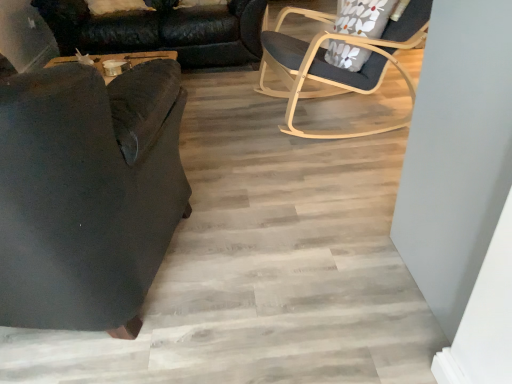
Question: Is floral fabric pillow at upper right oriented away from light wood/transparentobject at upper right, which is the 2th chair in front-to-back order?

Choices:
 (A) yes
 (B) no

Answer: (A)

Question: Is floral fabric pillow at upper right thinner than light wood/transparentobject at upper right, the second chair viewed from the left?

Choices:
 (A) yes
 (B) no

Answer: (A)

Question: Does floral fabric pillow at upper right contain light wood/transparentobject at upper right, arranged as the first chair when viewed from the right?

Choices:
 (A) no
 (B) yes

Answer: (A)

Question: Does floral fabric pillow at upper right touch light wood/transparentobject at upper right, the second chair viewed from the left?

Choices:
 (A) yes
 (B) no

Answer: (B)

Question: Is floral fabric pillow at upper right wider than light wood/transparentobject at upper right, arranged as the 1th chair when viewed from the back?

Choices:
 (A) yes
 (B) no

Answer: (B)

Question: Is floral fabric pillow at upper right closer to the viewer compared to light wood/transparentobject at upper right, arranged as the first chair when viewed from the right?

Choices:
 (A) yes
 (B) no

Answer: (B)

Question: Is light wood/transparentobject at upper right, arranged as the first chair when viewed from the right, located within dark fabric chair at left, positioned as the first chair in left-to-right order?

Choices:
 (A) yes
 (B) no

Answer: (B)

Question: From a real-world perspective, is dark fabric chair at left, which is counted as the 2th chair, starting from the back, positioned over light wood/transparentobject at upper right, which is the 2th chair in front-to-back order, based on gravity?

Choices:
 (A) yes
 (B) no

Answer: (A)

Question: Can you confirm if dark fabric chair at left, which ranks as the 2th chair in right-to-left order, is wider than light wood/transparentobject at upper right, the second chair viewed from the left?

Choices:
 (A) yes
 (B) no

Answer: (A)

Question: Is dark fabric chair at left, which is counted as the 2th chair, starting from the back, thinner than light wood/transparentobject at upper right, arranged as the 1th chair when viewed from the back?

Choices:
 (A) yes
 (B) no

Answer: (B)

Question: Can you confirm if dark fabric chair at left, which is counted as the 2th chair, starting from the back, is bigger than light wood/transparentobject at upper right, the second chair viewed from the left?

Choices:
 (A) no
 (B) yes

Answer: (B)

Question: From a real-world perspective, is dark fabric chair at left, positioned as the first chair in left-to-right order, physically below light wood/transparentobject at upper right, which is the 2th chair in front-to-back order?

Choices:
 (A) no
 (B) yes

Answer: (A)

Question: From a real-world perspective, is black leather couch at left positioned over dark fabric chair at left, which is counted as the 2th chair, starting from the back, based on gravity?

Choices:
 (A) no
 (B) yes

Answer: (A)